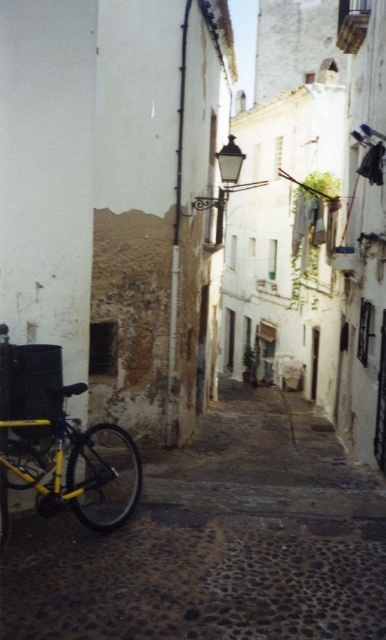
Question: Can you confirm if yellow metallic bicycle at lower left is thinner than yellow matte bicycle at lower left?

Choices:
 (A) yes
 (B) no

Answer: (B)

Question: Among these points, which one is farthest from the camera?

Choices:
 (A) (248, 513)
 (B) (111, 492)

Answer: (B)

Question: From the image, what is the correct spatial relationship of yellow metallic bicycle at lower left in relation to yellow matte bicycle at lower left?

Choices:
 (A) right
 (B) left

Answer: (A)

Question: Is yellow metallic bicycle at lower left positioned before yellow matte bicycle at lower left?

Choices:
 (A) yes
 (B) no

Answer: (A)

Question: Which object appears closest to the camera in this image?

Choices:
 (A) yellow matte bicycle at lower left
 (B) yellow metallic bicycle at lower left

Answer: (B)